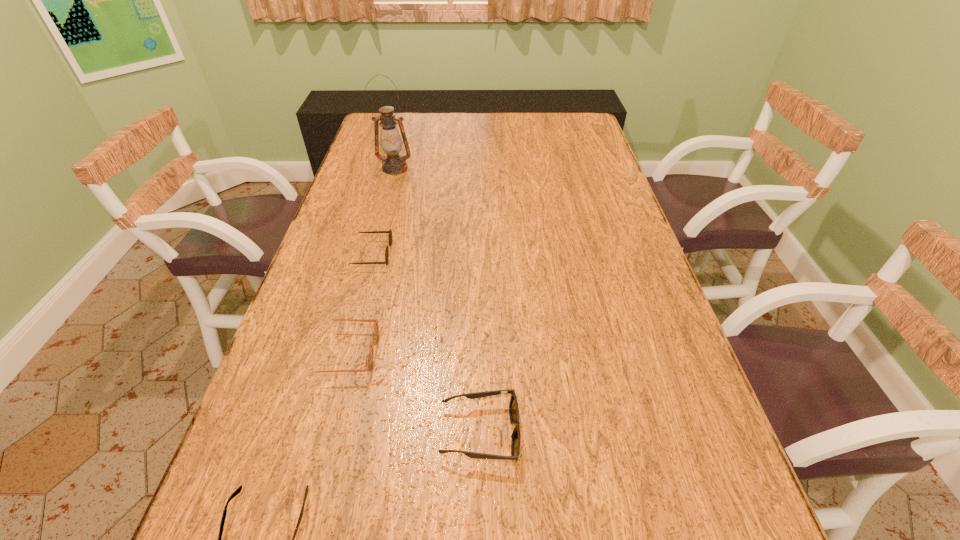
Where is `oil lamp at the left edge`? oil lamp at the left edge is located at coordinates (391, 143).

Identify the location of blank space at the far edge of the desktop. (471, 139).

Identify the location of free space at the left edge. (311, 305).

This screenshot has width=960, height=540. In the image, there is a desktop. Identify the location of blank space at the right edge. (585, 228).

The width and height of the screenshot is (960, 540). What are the coordinates of `vacant region between the rightmost sunglasses and the third farthest object` in the screenshot? It's located at (412, 393).

At what (x,y) coordinates should I click in order to perform the action: click on free space that is in between the rightmost object and the third nearest sunglasses. Please return your answer as a coordinate pair (x, y). This screenshot has width=960, height=540. Looking at the image, I should click on (412, 393).

You are a GUI agent. You are given a task and a screenshot of the screen. Output one action in this format:
    pyautogui.click(x=<x>, y=<y>)
    Task: Click on the vacant region between the rightmost sunglasses and the second farthest sunglasses
    
    Given the screenshot: What is the action you would take?
    pyautogui.click(x=412, y=393)

This screenshot has width=960, height=540. What are the coordinates of `free space between the rightmost sunglasses and the second farthest sunglasses` in the screenshot? It's located at (412, 393).

Locate an element on the screen. vacant space that's between the rightmost sunglasses and the third nearest object is located at coordinates (412, 393).

At what (x,y) coordinates should I click in order to perform the action: click on free point between the farthest object and the farthest sunglasses. Please return your answer as a coordinate pair (x, y). Looking at the image, I should click on (384, 211).